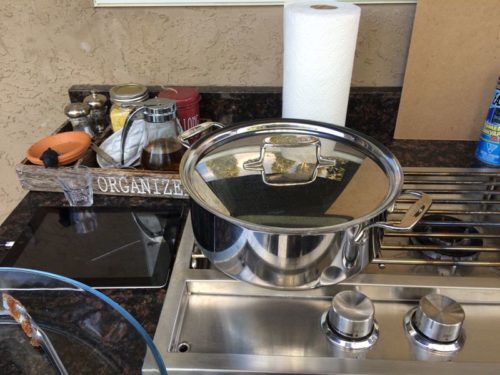
This screenshot has height=375, width=500. In order to click on handle for pot lid in this screenshot , I will do `click(299, 144)`, `click(19, 317)`.